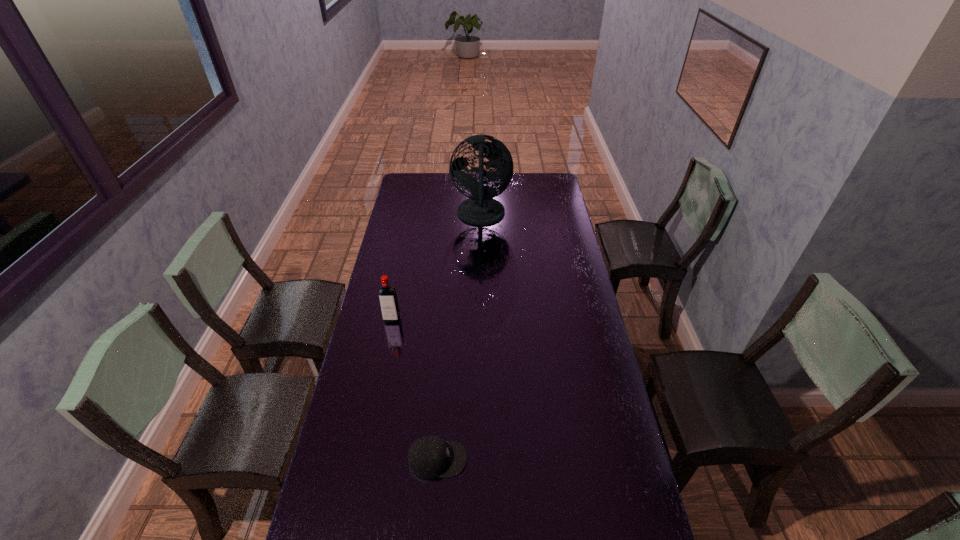
Identify the location of globe. Image resolution: width=960 pixels, height=540 pixels. (480, 209).

Image resolution: width=960 pixels, height=540 pixels. What are the coordinates of `the tallest object` in the screenshot? It's located at (480, 209).

Locate an element on the screen. This screenshot has width=960, height=540. the second tallest object is located at coordinates click(x=388, y=300).

At what (x,y) coordinates should I click in order to perform the action: click on the leftmost object. Please return your answer as a coordinate pair (x, y). Looking at the image, I should click on (388, 300).

Where is `the nearest object`? The height and width of the screenshot is (540, 960). the nearest object is located at coordinates (429, 457).

The image size is (960, 540). Identify the location of the shortest object. (429, 457).

Where is `free region located on the front-facing side of the globe`? free region located on the front-facing side of the globe is located at coordinates (429, 215).

Identify the location of vacant space situated 0.090m on the front-facing side of the globe. tap(433, 215).

Image resolution: width=960 pixels, height=540 pixels. I want to click on free space located on the front-facing side of the globe, so click(x=416, y=215).

Find the location of a particular element. The width and height of the screenshot is (960, 540). free space located on the front and back of the vodka is located at coordinates (375, 401).